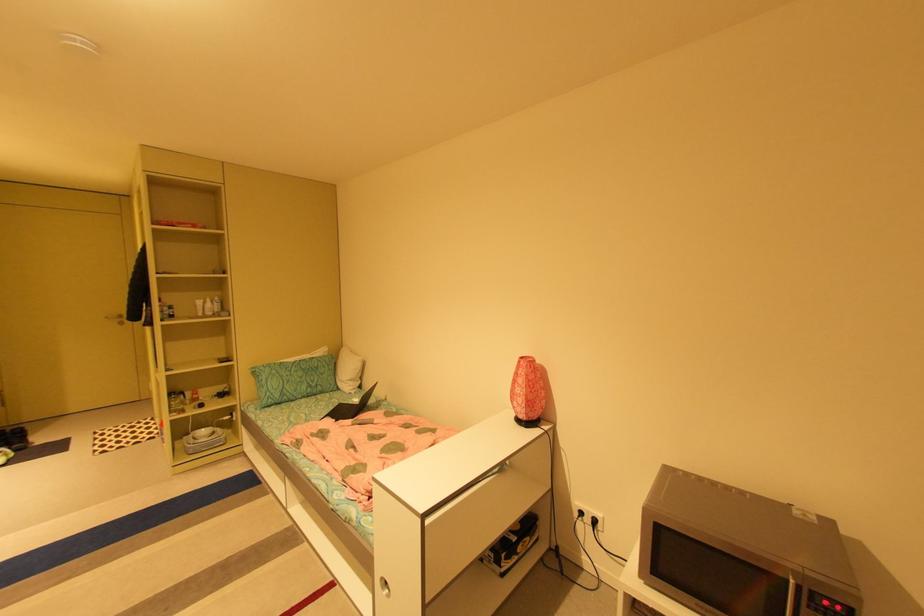
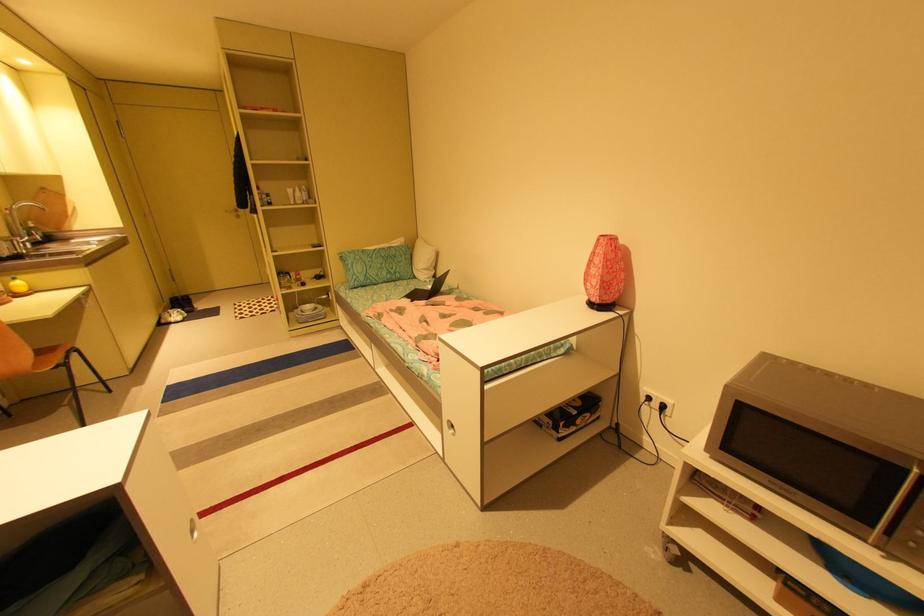
Locate, in the second image, the point that corresponds to the point at 205,302 in the first image.

(296, 191)